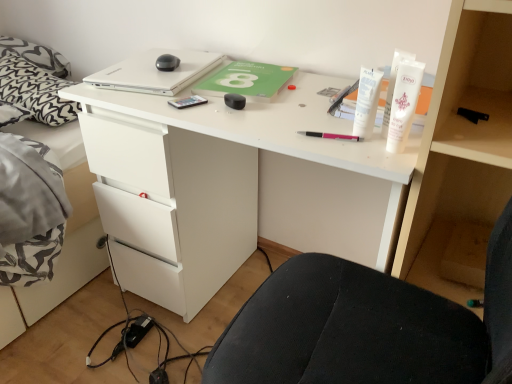
At what (x,y) coordinates should I click in order to perform the action: click on free space in front of satin silver phone at center, positioned as the 1th stationery in left-to-right order. Please return your answer as a coordinate pair (x, y). The image size is (512, 384). Looking at the image, I should click on (198, 119).